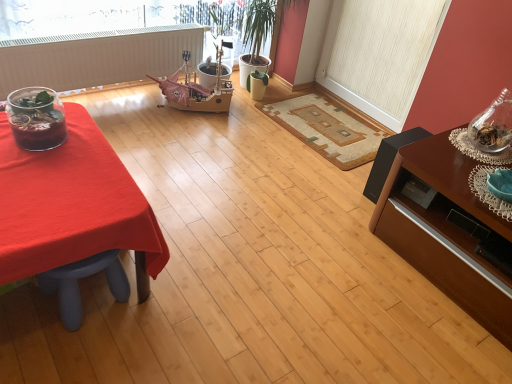
I want to click on vacant area located to the right-hand side of translucent glass terrarium at left, so click(x=82, y=148).